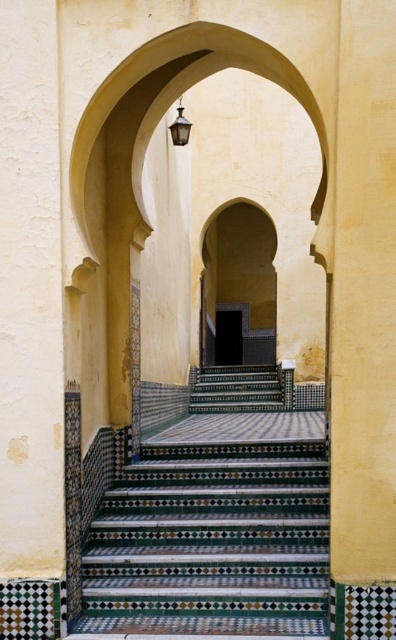
You are an architect designing a new building inspired by this traditional style. You need to ensure that the distance between the smooth beige arch at center and the matte black lantern at upper center is exactly 10 meters for structural reasons. Based on the image, is the current distance in the scene sufficient? Please explain.

The distance between the smooth beige arch at center and the matte black lantern at upper center is 11.39 meters, which is longer than the required 10 meters. Therefore, the current distance in the scene is sufficient as it exceeds the structural requirement of 10 meters.

You are an interior designer planning to install a new lighting fixture. You have a space that can accommodate objects up to the size of the matte black lantern at upper center. Can the multicolored mosaic stairs at center fit in that space?

The multicolored mosaic stairs at center is larger in size than the matte black lantern at upper center, so it cannot fit in the space designated for the lantern.